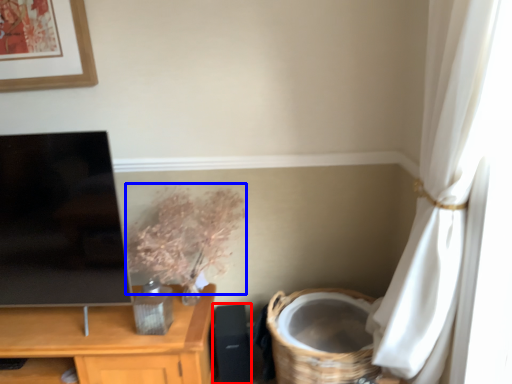
Question: Which of the following is the closest to the observer, speaker (highlighted by a red box) or floral arrangement (highlighted by a blue box)?

Choices:
 (A) speaker
 (B) floral arrangement

Answer: (B)